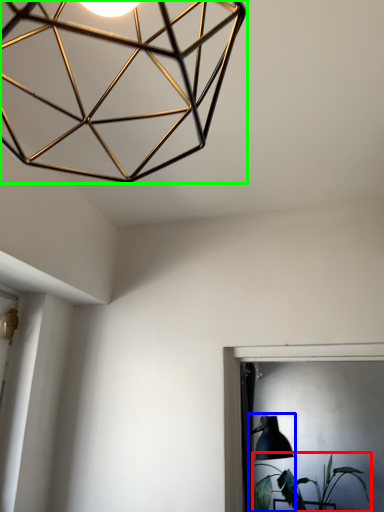
Question: Which is farther away from houseplant (highlighted by a red box)? table lamp (highlighted by a blue box) or lamp (highlighted by a green box)?

Choices:
 (A) table lamp
 (B) lamp

Answer: (B)